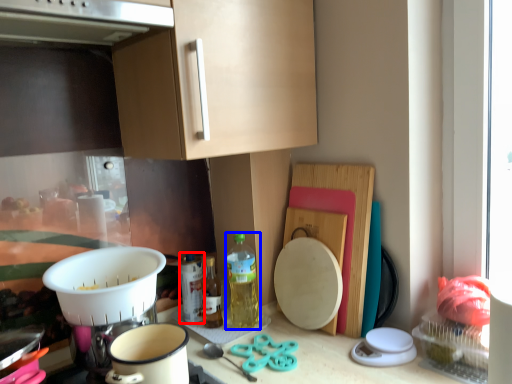
Question: Which object is closer to the camera taking this photo, bottle (highlighted by a red box) or bottle (highlighted by a blue box)?

Choices:
 (A) bottle
 (B) bottle

Answer: (B)